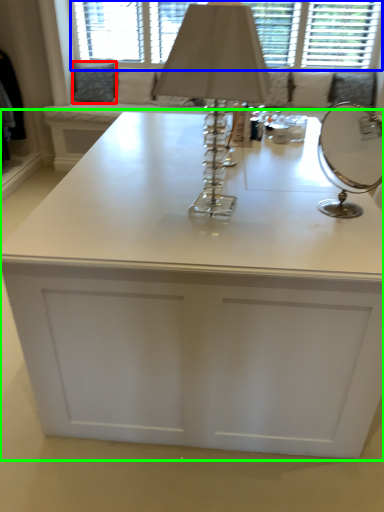
Question: Which object is positioned closest to pillow (highlighted by a red box)? Select from bay window (highlighted by a blue box) and table (highlighted by a green box).

Choices:
 (A) bay window
 (B) table

Answer: (A)